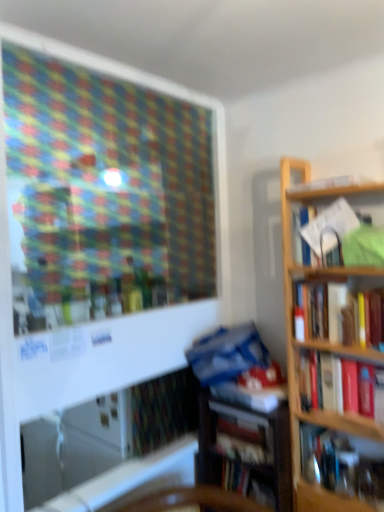
The image size is (384, 512). In order to click on hardcover book at right, which is counted as the 5th book, starting from the bottom in this screenshot , I will do `click(341, 313)`.

From the picture: What is the approximate width of hardcover book at right, positioned as the 3th book in top-to-bottom order?

The width of hardcover book at right, positioned as the 3th book in top-to-bottom order, is 7.66 inches.

What do you see at coordinates (246, 483) in the screenshot? I see `hardcover book at lower center, the seventh book when ordered from top to bottom` at bounding box center [246, 483].

Describe the element at coordinates (345, 236) in the screenshot. I see `white paper at upper right, which is counted as the 6th book, starting from the bottom` at that location.

This screenshot has width=384, height=512. In order to click on blue matte book at center, which is the 5th book from top to bottom in this screenshot , I will do `click(254, 389)`.

You are a GUI agent. You are given a task and a screenshot of the screen. Output one action in this format:
    pyautogui.click(x=<x>, y=<y>)
    Task: Click on the hardcover book at right, positioned as the 3th book in top-to-bottom order
    
    Given the screenshot: What is the action you would take?
    341,313

Which is closer, (263, 503) or (316, 184)?

The point (316, 184) is closer.

From the image's perspective, does hardcover book at lower center, the first book in the bottom-to-top sequence, appear lower than hardcover book at upper right, which appears as the 1th book when viewed from the top?

Yes, from the image's perspective, hardcover book at lower center, the first book in the bottom-to-top sequence, is below hardcover book at upper right, which appears as the 1th book when viewed from the top.

Would you consider hardcover book at lower center, the seventh book when ordered from top to bottom, to be distant from hardcover book at upper right, which appears as the seventh book when ordered from the bottom?

hardcover book at lower center, the seventh book when ordered from top to bottom, is far away from hardcover book at upper right, which appears as the seventh book when ordered from the bottom.

How many degrees apart are the facing directions of hardcover book at lower center, the first book in the bottom-to-top sequence, and hardcover book at upper right, which appears as the seventh book when ordered from the bottom?

There is a 2.34-degree angle between the facing directions of hardcover book at lower center, the first book in the bottom-to-top sequence, and hardcover book at upper right, which appears as the seventh book when ordered from the bottom.

Which is less distant, (355,405) or (251,383)?

Point (355,405) is positioned closer to the camera compared to point (251,383).

From a real-world perspective, does hardcover book at right, positioned as the fourth book in top-to-bottom order, sit lower than blue matte book at center, the 3th book from the bottom?

No, from a real-world perspective, hardcover book at right, positioned as the fourth book in top-to-bottom order, is not below blue matte book at center, the 3th book from the bottom.

Is hardcover book at right, the 4th book when ordered from bottom to top, positioned before blue matte book at center, which is the 5th book from top to bottom?

That is True.

Which is more to the right, hardcover book at right, which is counted as the 5th book, starting from the bottom, or hardcover book at lower center, marked as the second book in a bottom-to-top arrangement?

hardcover book at right, which is counted as the 5th book, starting from the bottom, is more to the right.

Looking at this image, is hardcover book at right, which is counted as the 5th book, starting from the bottom, outside of hardcover book at lower center, which ranks as the 6th book in top-to-bottom order?

Yes, hardcover book at right, which is counted as the 5th book, starting from the bottom, is not within hardcover book at lower center, which ranks as the 6th book in top-to-bottom order.

Is hardcover book at right, which is counted as the 5th book, starting from the bottom, placed right next to hardcover book at lower center, marked as the second book in a bottom-to-top arrangement?

hardcover book at right, which is counted as the 5th book, starting from the bottom, and hardcover book at lower center, marked as the second book in a bottom-to-top arrangement, are clearly separated.

From a real-world perspective, which object stands above the other?

In real-world perspective, hardcover book at right, positioned as the 3th book in top-to-bottom order, is above.

Does hardcover book at upper right, which appears as the 1th book when viewed from the top, appear on the left side of blue matte book at center, which is the 5th book from top to bottom?

No, hardcover book at upper right, which appears as the 1th book when viewed from the top, is not to the left of blue matte book at center, which is the 5th book from top to bottom.

Starting from the hardcover book at upper right, which appears as the 1th book when viewed from the top, which book is the 2nd one behind? Please provide its 2D coordinates.

[(254, 389)]

From the image's perspective, which is below, hardcover book at upper right, which appears as the seventh book when ordered from the bottom, or blue matte book at center, which is the 5th book from top to bottom?

blue matte book at center, which is the 5th book from top to bottom, appears lower in the image.

Is hardcover book at lower center, marked as the second book in a bottom-to-top arrangement, taller than hardcover book at lower center, the first book in the bottom-to-top sequence?

No, hardcover book at lower center, marked as the second book in a bottom-to-top arrangement, is not taller than hardcover book at lower center, the first book in the bottom-to-top sequence.

Is hardcover book at lower center, the first book in the bottom-to-top sequence, inside hardcover book at lower center, marked as the second book in a bottom-to-top arrangement?

Actually, hardcover book at lower center, the first book in the bottom-to-top sequence, is outside hardcover book at lower center, marked as the second book in a bottom-to-top arrangement.

There is a hardcover book at lower center, the seventh book when ordered from top to bottom. Identify the location of the 1st book above it (from the image's perspective). This screenshot has width=384, height=512. (244, 440).

Consider the image. Which is less distant, (x=220, y=438) or (x=249, y=492)?

Point (x=220, y=438) is positioned farther from the camera compared to point (x=249, y=492).

Is hardcover book at right, the 4th book when ordered from bottom to top, next to hardcover book at right, which is counted as the 5th book, starting from the bottom, and touching it?

No, hardcover book at right, the 4th book when ordered from bottom to top, is not with hardcover book at right, which is counted as the 5th book, starting from the bottom.

Find the location of a particular element. The width and height of the screenshot is (384, 512). the 1st book located beneath the hardcover book at right, which is counted as the 5th book, starting from the bottom (from a real-world perspective) is located at coordinates (326, 382).

Is hardcover book at right, positioned as the fourth book in top-to-bottom order, completely or partially outside of hardcover book at right, positioned as the 3th book in top-to-bottom order?

Absolutely, hardcover book at right, positioned as the fourth book in top-to-bottom order, is external to hardcover book at right, positioned as the 3th book in top-to-bottom order.

Between hardcover book at right, positioned as the fourth book in top-to-bottom order, and hardcover book at right, which is counted as the 5th book, starting from the bottom, which one has smaller width?

With smaller width is hardcover book at right, which is counted as the 5th book, starting from the bottom.

Could you measure the distance between hardcover book at right, positioned as the fourth book in top-to-bottom order, and hardcover book at upper right, which appears as the seventh book when ordered from the bottom?

hardcover book at right, positioned as the fourth book in top-to-bottom order, and hardcover book at upper right, which appears as the seventh book when ordered from the bottom, are 29.44 inches apart from each other.

From a real-world perspective, is hardcover book at right, the 4th book when ordered from bottom to top, physically below hardcover book at upper right, which appears as the 1th book when viewed from the top?

Yes.

Is hardcover book at right, the 4th book when ordered from bottom to top, facing towards hardcover book at upper right, which appears as the seventh book when ordered from the bottom?

No, hardcover book at right, the 4th book when ordered from bottom to top, is not facing towards hardcover book at upper right, which appears as the seventh book when ordered from the bottom.

Is hardcover book at right, positioned as the fourth book in top-to-bottom order, far away from hardcover book at upper right, which appears as the seventh book when ordered from the bottom?

They are positioned close to each other.

Where is `the 4th book behind the hardcover book at upper right, which appears as the 1th book when viewed from the top`? The image size is (384, 512). the 4th book behind the hardcover book at upper right, which appears as the 1th book when viewed from the top is located at coordinates (246, 483).

From a real-world perspective, starting from the hardcover book at right, positioned as the fourth book in top-to-bottom order, which book is the 1st one below it? Please provide its 2D coordinates.

[(254, 389)]

Considering their positions, is hardcover book at right, the 4th book when ordered from bottom to top, positioned closer to hardcover book at upper right, which appears as the 1th book when viewed from the top, than hardcover book at lower center, the first book in the bottom-to-top sequence?

hardcover book at right, the 4th book when ordered from bottom to top, lies closer to hardcover book at upper right, which appears as the 1th book when viewed from the top, than the other object.

Estimate the real-world distances between objects in this image. Which object is further from hardcover book at right, positioned as the fourth book in top-to-bottom order, hardcover book at right, which is counted as the 5th book, starting from the bottom, or hardcover book at upper right, which appears as the 1th book when viewed from the top?

Among the two, hardcover book at upper right, which appears as the 1th book when viewed from the top, is located further to hardcover book at right, positioned as the fourth book in top-to-bottom order.

When comparing their distances from hardcover book at right, positioned as the 3th book in top-to-bottom order, does blue matte book at center, which is the 5th book from top to bottom, or hardcover book at lower center, which ranks as the 6th book in top-to-bottom order, seem closer?

Among the two, blue matte book at center, which is the 5th book from top to bottom, is located nearer to hardcover book at right, positioned as the 3th book in top-to-bottom order.

From the image, which object appears to be farther from hardcover book at upper right, which appears as the 1th book when viewed from the top, hardcover book at right, positioned as the 3th book in top-to-bottom order, or hardcover book at lower center, marked as the second book in a bottom-to-top arrangement?

hardcover book at lower center, marked as the second book in a bottom-to-top arrangement.

Estimate the real-world distances between objects in this image. Which object is closer to hardcover book at right, which is counted as the 5th book, starting from the bottom, hardcover book at upper right, which appears as the seventh book when ordered from the bottom, or hardcover book at right, positioned as the fourth book in top-to-bottom order?

hardcover book at right, positioned as the fourth book in top-to-bottom order, is positioned closer to the anchor hardcover book at right, which is counted as the 5th book, starting from the bottom.

From the image, which object appears to be farther from hardcover book at lower center, the first book in the bottom-to-top sequence, hardcover book at right, positioned as the 3th book in top-to-bottom order, or blue matte book at center, which is the 5th book from top to bottom?

hardcover book at right, positioned as the 3th book in top-to-bottom order, is further to hardcover book at lower center, the first book in the bottom-to-top sequence.

When comparing their distances from hardcover book at right, which is counted as the 5th book, starting from the bottom, does blue matte book at center, the 3th book from the bottom, or hardcover book at upper right, which appears as the seventh book when ordered from the bottom, seem closer?

blue matte book at center, the 3th book from the bottom, is positioned closer to the anchor hardcover book at right, which is counted as the 5th book, starting from the bottom.

Estimate the real-world distances between objects in this image. Which object is further from hardcover book at upper right, which appears as the seventh book when ordered from the bottom, hardcover book at lower center, the first book in the bottom-to-top sequence, or blue matte book at center, which is the 5th book from top to bottom?

hardcover book at lower center, the first book in the bottom-to-top sequence, is positioned further to the anchor hardcover book at upper right, which appears as the seventh book when ordered from the bottom.

Identify the location of book between white paper at upper right, which is counted as the 6th book, starting from the bottom, and hardcover book at right, positioned as the fourth book in top-to-bottom order, from top to bottom. [341, 313].

The width and height of the screenshot is (384, 512). What are the coordinates of `book that lies between blue matte book at center, the 3th book from the bottom, and hardcover book at lower center, the first book in the bottom-to-top sequence, from top to bottom` in the screenshot? It's located at (244, 440).

Image resolution: width=384 pixels, height=512 pixels. I want to click on book between hardcover book at right, positioned as the 3th book in top-to-bottom order, and blue matte book at center, the 3th book from the bottom, in the up-down direction, so click(x=326, y=382).

Locate an element on the screen. Image resolution: width=384 pixels, height=512 pixels. book between hardcover book at upper right, which appears as the seventh book when ordered from the bottom, and hardcover book at right, which is counted as the 5th book, starting from the bottom, from top to bottom is located at coordinates (345, 236).